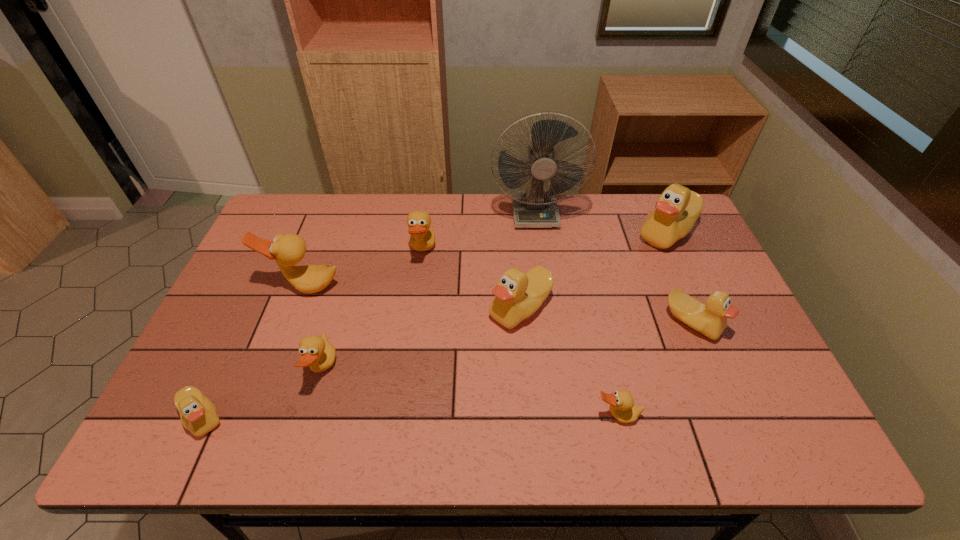
Locate an element on the screen. the leftmost beige duck is located at coordinates (198, 414).

Where is `the nearest beige duck`? Image resolution: width=960 pixels, height=540 pixels. the nearest beige duck is located at coordinates (198, 414).

The image size is (960, 540). What are the coordinates of `the smallest tan duck` in the screenshot? It's located at (622, 407).

Image resolution: width=960 pixels, height=540 pixels. I want to click on the nearest tan duck, so click(622, 407).

Identify the location of vacant region located on the front-facing side of the gray fan. (551, 325).

Find the location of `vacant space located at the beak of the farthest beige duck`. vacant space located at the beak of the farthest beige duck is located at coordinates (552, 233).

You are a GUI agent. You are given a task and a screenshot of the screen. Output one action in this format:
    pyautogui.click(x=<x>, y=<y>)
    Task: Click on the vacant space located at the beak of the farthest beige duck
    
    Given the screenshot: What is the action you would take?
    pyautogui.click(x=612, y=233)

I want to click on vacant space located 0.070m at the beak of the farthest beige duck, so click(612, 233).

The image size is (960, 540). Find the location of `free space located on the beak of the biggest tan duck`. free space located on the beak of the biggest tan duck is located at coordinates (253, 423).

The height and width of the screenshot is (540, 960). I want to click on vacant space situated 0.370m at the beak of the fourth duck from right to left, so click(355, 308).